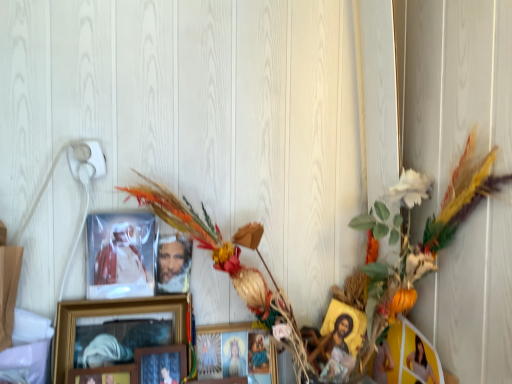
Question: In which direction should I rotate to look at wooden framed picture at center, which is counted as the fourth picture frame, starting from the right?

Choices:
 (A) right
 (B) left

Answer: (B)

Question: Is wooden framed picture at center, which is counted as the fourth picture frame, starting from the right, turned away from matte wooden picture frame at center, which is the 3th picture frame from left to right?

Choices:
 (A) yes
 (B) no

Answer: (A)

Question: From the image's perspective, is wooden framed picture at center, which is counted as the fourth picture frame, starting from the right, beneath matte wooden picture frame at center, which is the 3th picture frame from left to right?

Choices:
 (A) no
 (B) yes

Answer: (A)

Question: Is wooden framed picture at center, the second picture frame viewed from the left, taller than matte wooden picture frame at center, which is the 3th picture frame from left to right?

Choices:
 (A) no
 (B) yes

Answer: (B)

Question: Is wooden framed picture at center, which is counted as the fourth picture frame, starting from the right, aimed at matte wooden picture frame at center, which is the 3th picture frame from left to right?

Choices:
 (A) yes
 (B) no

Answer: (A)

Question: Is wooden framed picture at center, which is counted as the fourth picture frame, starting from the right, bigger than matte wooden picture frame at center, acting as the third picture frame starting from the right?

Choices:
 (A) yes
 (B) no

Answer: (A)

Question: Is wooden framed picture at center, the second picture frame viewed from the left, to the left of matte wooden picture frame at center, which is the 3th picture frame from left to right, from the viewer's perspective?

Choices:
 (A) no
 (B) yes

Answer: (B)

Question: Considering the relative sizes of matte yellow photo frame at right, the first picture frame viewed from the right, and matte plastic figure at upper left in the image provided, is matte yellow photo frame at right, the first picture frame viewed from the right, smaller than matte plastic figure at upper left?

Choices:
 (A) no
 (B) yes

Answer: (A)

Question: Does matte yellow photo frame at right, the first picture frame viewed from the right, come behind matte plastic figure at upper left?

Choices:
 (A) no
 (B) yes

Answer: (A)

Question: From the image's perspective, is matte yellow photo frame at right, the first picture frame viewed from the right, located beneath matte plastic figure at upper left?

Choices:
 (A) yes
 (B) no

Answer: (A)

Question: Would you say matte yellow photo frame at right, the first picture frame viewed from the right, is outside matte plastic figure at upper left?

Choices:
 (A) yes
 (B) no

Answer: (A)

Question: From a real-world perspective, is matte yellow photo frame at right, the first picture frame viewed from the right, on top of matte plastic figure at upper left?

Choices:
 (A) yes
 (B) no

Answer: (B)

Question: Can you confirm if matte yellow photo frame at right, the first picture frame viewed from the right, is thinner than matte plastic figure at upper left?

Choices:
 (A) yes
 (B) no

Answer: (B)

Question: From a real-world perspective, is matte yellow photo frame at right, the first picture frame viewed from the right, located higher than wooden framed picture at center, which is counted as the fourth picture frame, starting from the right?

Choices:
 (A) yes
 (B) no

Answer: (B)